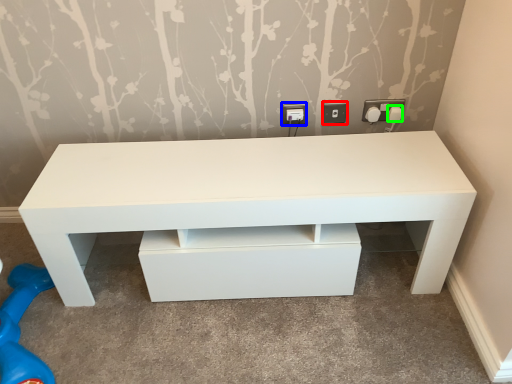
Question: Estimate the real-world distances between objects in this image. Which object is farther from electric outlet (highlighted by a red box), electric outlet (highlighted by a blue box) or knob (highlighted by a green box)?

Choices:
 (A) electric outlet
 (B) knob

Answer: (B)